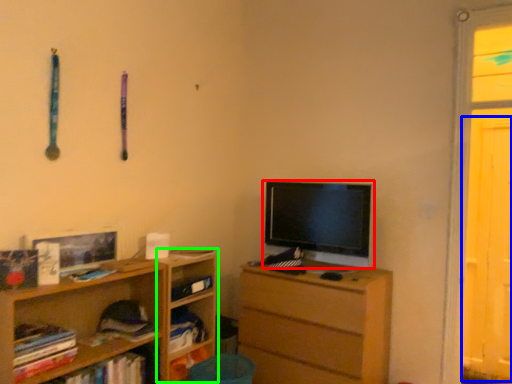
Question: Estimate the real-world distances between objects in this image. Which object is farther from television (highlighted by a red box), screen door (highlighted by a blue box) or shelf (highlighted by a green box)?

Choices:
 (A) screen door
 (B) shelf

Answer: (A)